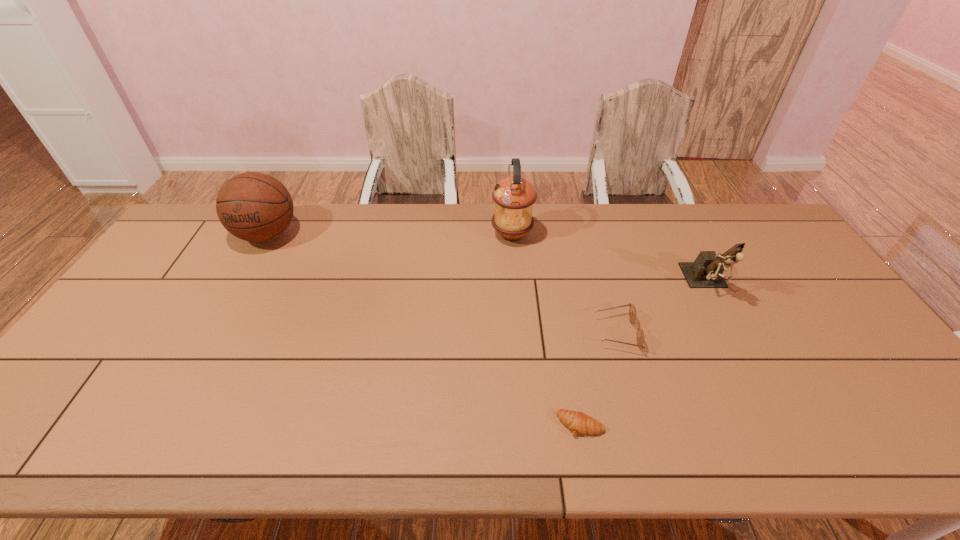
Identify the location of free space between the leftmost object and the spectacles. The width and height of the screenshot is (960, 540). (442, 284).

What are the coordinates of `free space between the figurine and the shortest object` in the screenshot? It's located at (643, 354).

Find the location of a particular element. free space between the basketball and the tallest object is located at coordinates (390, 235).

This screenshot has width=960, height=540. In order to click on vacant area that lies between the figurine and the leftmost object in this screenshot , I will do `click(487, 259)`.

You are a GUI agent. You are given a task and a screenshot of the screen. Output one action in this format:
    pyautogui.click(x=<x>, y=<y>)
    Task: Click on the vacant area that lies between the nearest object and the rightmost object
    The width and height of the screenshot is (960, 540).
    Given the screenshot: What is the action you would take?
    pyautogui.click(x=643, y=354)

This screenshot has width=960, height=540. What are the coordinates of `object that is the fourth nearest to the shortest object` in the screenshot? It's located at [256, 207].

Select which object appears as the third closest to the fourth farthest object. Please provide its 2D coordinates. Your answer should be formatted as a tuple, i.e. [(x, y)], where the tuple contains the x and y coordinates of a point satisfying the conditions above.

[(514, 196)]

The image size is (960, 540). In order to click on free point that satisfies the following two spatial constraints: 1. on the side with brand label of the tallest object; 2. on the right side of the basketball in this screenshot , I will do 267,235.

At what (x,y) coordinates should I click in order to perform the action: click on free space that satisfies the following two spatial constraints: 1. on the side with brand label of the leftmost object; 2. on the left side of the tallest object. Please return your answer as a coordinate pair (x, y). The width and height of the screenshot is (960, 540). Looking at the image, I should click on (267, 235).

This screenshot has height=540, width=960. Identify the location of vacant position in the image that satisfies the following two spatial constraints: 1. on the side with brand label of the tallest object; 2. on the right side of the basketball. (267, 235).